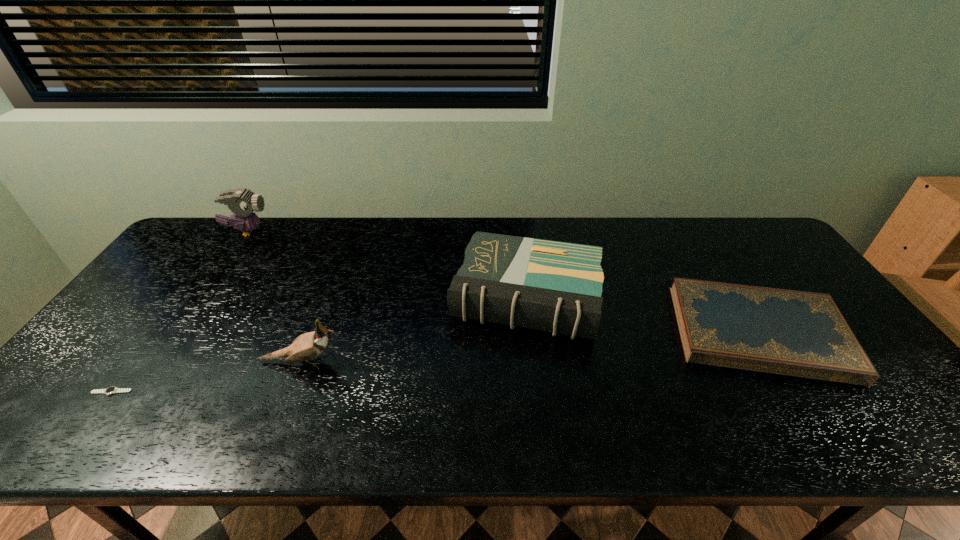
At what (x,y) coordinates should I click in order to perform the action: click on the farther bird. Please return your answer as a coordinate pair (x, y). The width and height of the screenshot is (960, 540). Looking at the image, I should click on (242, 202).

I want to click on the farthest object, so click(242, 202).

Where is `the right bird`? The width and height of the screenshot is (960, 540). the right bird is located at coordinates (309, 345).

What are the coordinates of `the third object from right to left` in the screenshot? It's located at (309, 345).

Image resolution: width=960 pixels, height=540 pixels. What are the coordinates of `the taller paperback book` in the screenshot? It's located at (552, 286).

Identify the location of the left paperback book. The width and height of the screenshot is (960, 540). (552, 286).

You are a GUI agent. You are given a task and a screenshot of the screen. Output one action in this format:
    pyautogui.click(x=<x>, y=<y>)
    Task: Click on the fourth tallest object
    The height and width of the screenshot is (540, 960).
    Given the screenshot: What is the action you would take?
    pyautogui.click(x=803, y=334)

You are a GUI agent. You are given a task and a screenshot of the screen. Output one action in this format:
    pyautogui.click(x=<x>, y=<y>)
    Task: Click on the right paperback book
    
    Given the screenshot: What is the action you would take?
    pyautogui.click(x=803, y=334)

You are a GUI agent. You are given a task and a screenshot of the screen. Output one action in this format:
    pyautogui.click(x=<x>, y=<y>)
    Task: Click on the shortest object
    This screenshot has height=540, width=960.
    Given the screenshot: What is the action you would take?
    [111, 390]

Image resolution: width=960 pixels, height=540 pixels. In order to click on vacant space located at the beak of the left bird in this screenshot , I will do `click(324, 231)`.